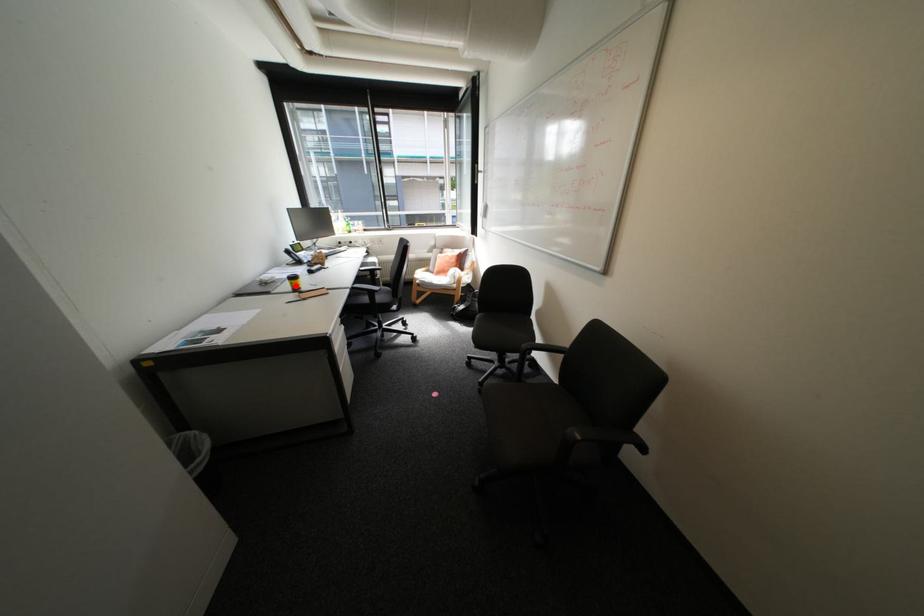
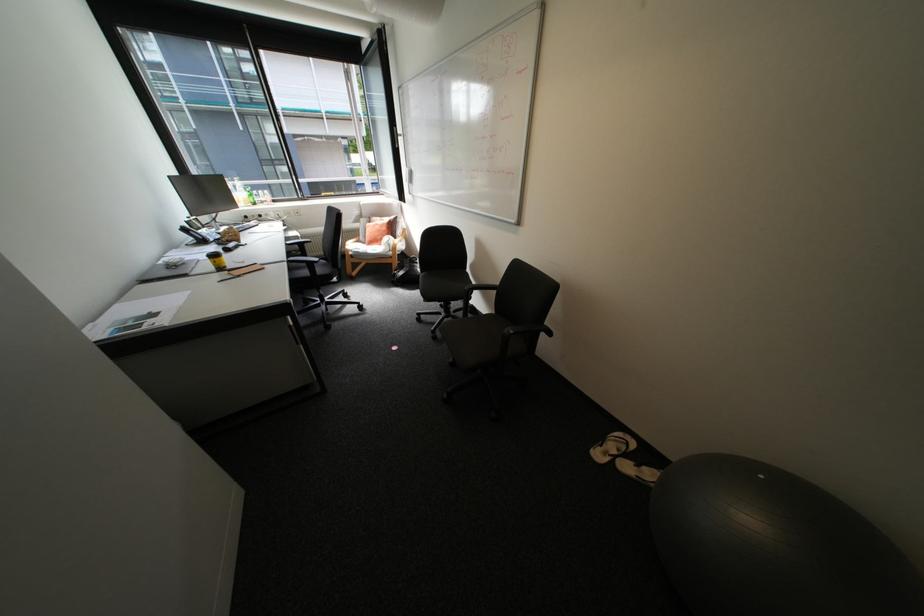
Question: I am providing you with two images of the same scene from different viewpoints. A red point is marked on the first image. Can you still see the location of the red point in image 2?

Choices:
 (A) Yes
 (B) No

Answer: (A)